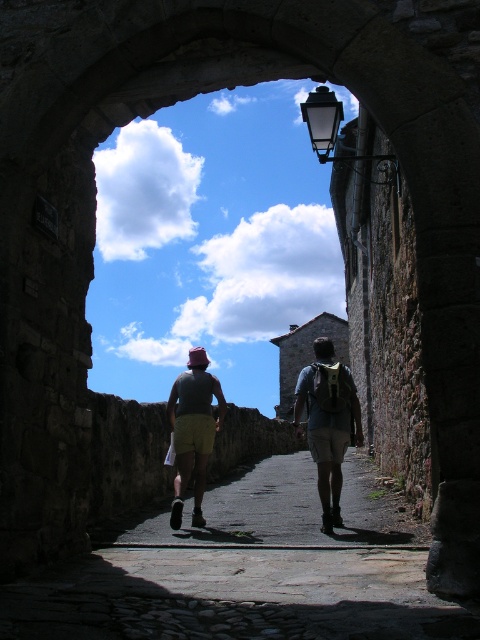
You are standing at the entrance of the archway and want to take a photo of both the gray fabric shorts at center and the matte gray shirt at center. Since you have a camera with a 50mm lens, which has a maximum focusing distance of 15 meters, will you be able to capture both subjects clearly in focus?

The gray fabric shorts at center is 14.42 meters away from the matte gray shirt at center. Since the maximum focusing distance of the camera is 15 meters, both subjects are within the range and can be captured clearly in focus.

You are standing at the stone archway and want to walk towards the two points marked in the image. Which point, point (326, 403) or point (176, 480), should you head towards if you want to reach the one that is closer to the streetlamp on the right side of the archway?

Point (326, 403) is in front of point (176, 480), so it is closer to the streetlamp on the right side of the archway. Therefore, you should head towards point (326, 403).